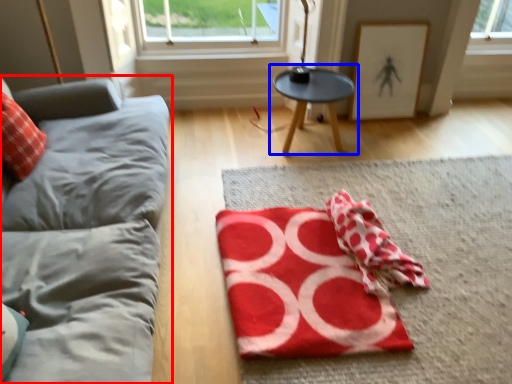
Question: Which object is further to the camera taking this photo, studio couch (highlighted by a red box) or table (highlighted by a blue box)?

Choices:
 (A) studio couch
 (B) table

Answer: (B)